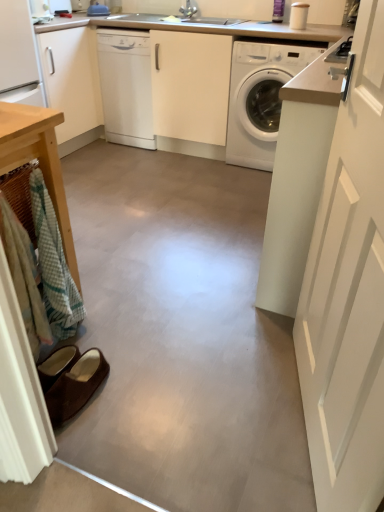
You are a GUI agent. You are given a task and a screenshot of the screen. Output one action in this format:
    pyautogui.click(x=<x>, y=<y>)
    Task: Click on the unoccupied space behind brown suede slippers at lower left
    This screenshot has width=384, height=512.
    Given the screenshot: What is the action you would take?
    pyautogui.click(x=104, y=346)